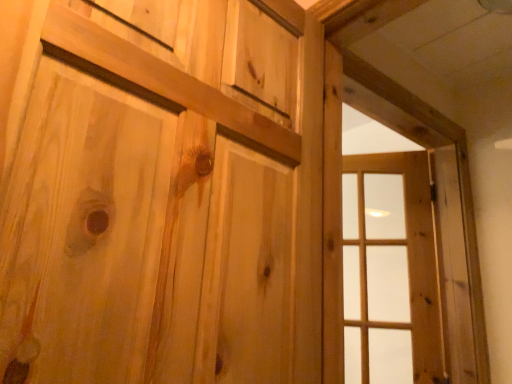
The width and height of the screenshot is (512, 384). I want to click on clear glass window at right, so click(390, 271).

Is natural wood door at center facing away from natural wood window frame at right?

natural wood door at center is not turned away from natural wood window frame at right.

Is natural wood door at center wider or thinner than natural wood window frame at right?

Clearly, natural wood door at center has more width compared to natural wood window frame at right.

Based on the photo, from a real-world perspective, is natural wood door at center physically above natural wood window frame at right?

No, from a real-world perspective, natural wood door at center is not above natural wood window frame at right.

The image size is (512, 384). In order to click on door on the left of natural wood window frame at right in this screenshot , I will do `click(161, 192)`.

Considering the points (475, 315) and (118, 22), which point is in front, point (475, 315) or point (118, 22)?

Point (118, 22)

In the scene shown: In terms of width, does natural wood window frame at right look wider or thinner when compared to natural wood door at center?

natural wood window frame at right is thinner than natural wood door at center.

Is the depth of natural wood window frame at right less than that of natural wood door at center?

No, it is behind natural wood door at center.

You are a GUI agent. You are given a task and a screenshot of the screen. Output one action in this format:
    pyautogui.click(x=<x>, y=<y>)
    Task: Click on the door lying above the natural wood window frame at right (from the image's perspective)
    Image resolution: width=512 pixels, height=384 pixels.
    Given the screenshot: What is the action you would take?
    pyautogui.click(x=161, y=192)

Is clear glass window at right shorter than natural wood door at center?

No, clear glass window at right is not shorter than natural wood door at center.

Can you tell me how much clear glass window at right and natural wood door at center differ in facing direction?

There is a 56.3-degree angle between the facing directions of clear glass window at right and natural wood door at center.

Can you confirm if clear glass window at right is smaller than natural wood door at center?

Yes, clear glass window at right is smaller than natural wood door at center.

Which is more to the right, clear glass window at right or natural wood door at center?

clear glass window at right.

Is natural wood window frame at right aimed at clear glass window at right?

Yes, natural wood window frame at right is turned towards clear glass window at right.

From a real-world perspective, is natural wood window frame at right physically below clear glass window at right?

Actually, natural wood window frame at right is physically above clear glass window at right in the real world.

Does natural wood window frame at right come in front of clear glass window at right?

Yes.

Looking at the image, does natural wood window frame at right seem bigger or smaller compared to clear glass window at right?

In the image, natural wood window frame at right appears to be larger than clear glass window at right.

Is natural wood door at center taller or shorter than clear glass window at right?

Clearly, natural wood door at center is shorter compared to clear glass window at right.

From a real-world perspective, which is physically above, natural wood door at center or clear glass window at right?

natural wood door at center is physically above.

Is there a large distance between natural wood door at center and clear glass window at right?

Yes, natural wood door at center and clear glass window at right are quite far apart.

Which object is wider, clear glass window at right or natural wood window frame at right?

Wider between the two is clear glass window at right.

What's the angular difference between clear glass window at right and natural wood window frame at right's facing directions?

clear glass window at right and natural wood window frame at right are facing 50.8 degrees away from each other.

Which is more to the right, clear glass window at right or natural wood window frame at right?

From the viewer's perspective, clear glass window at right appears more on the right side.

Which object is further away from the camera, clear glass window at right or natural wood window frame at right?

clear glass window at right is more distant.

At what (x,y) coordinates should I click in order to perform the action: click on door that appears above the natural wood window frame at right (from the image's perspective). Please return your answer as a coordinate pair (x, y). Looking at the image, I should click on (161, 192).

The width and height of the screenshot is (512, 384). I want to click on window frame below the natural wood door at center (from the image's perspective), so click(436, 204).

Based on their spatial positions, is natural wood window frame at right or clear glass window at right further from natural wood door at center?

clear glass window at right.

Estimate the real-world distances between objects in this image. Which object is further from natural wood door at center, clear glass window at right or natural wood window frame at right?

Among the two, clear glass window at right is located further to natural wood door at center.

From the picture: Based on their spatial positions, is natural wood door at center or clear glass window at right closer to natural wood window frame at right?

clear glass window at right is positioned closer to the anchor natural wood window frame at right.

From the image, which object appears to be farther from natural wood window frame at right, clear glass window at right or natural wood door at center?

natural wood door at center is positioned further to the anchor natural wood window frame at right.

From the picture: Considering their positions, is natural wood window frame at right positioned further to clear glass window at right than natural wood door at center?

natural wood door at center lies further to clear glass window at right than the other object.

Estimate the real-world distances between objects in this image. Which object is further from clear glass window at right, natural wood door at center or natural wood window frame at right?

natural wood door at center lies further to clear glass window at right than the other object.

Where is `window frame located between natural wood door at center and clear glass window at right in the depth direction`? window frame located between natural wood door at center and clear glass window at right in the depth direction is located at coordinates (436, 204).